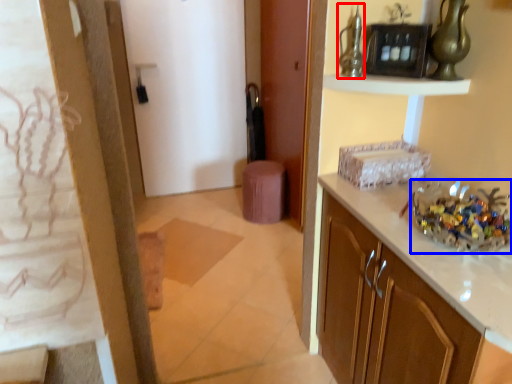
Question: Which object appears farthest to the camera in this image, glass vase (highlighted by a red box) or floral arrangement (highlighted by a blue box)?

Choices:
 (A) glass vase
 (B) floral arrangement

Answer: (A)